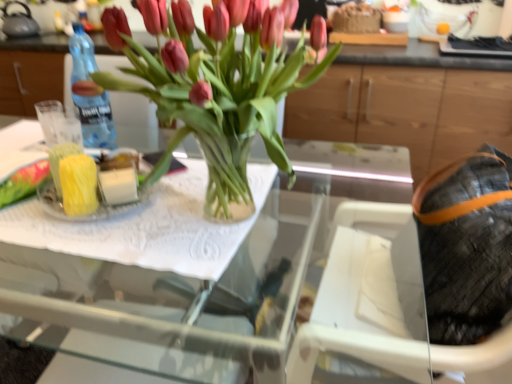
Question: Is leather textured bag at right taller or shorter than wooden cabinet at upper center?

Choices:
 (A) short
 (B) tall

Answer: (A)

Question: Do you think leather textured bag at right is within wooden cabinet at upper center, or outside of it?

Choices:
 (A) inside
 (B) outside

Answer: (B)

Question: Estimate the real-world distances between objects in this image. Which object is closer to the blue plastic bottle at left?

Choices:
 (A) clear glass tray at center
 (B) leather textured bag at right
 (C) transparent glass vase at center
 (D) wooden cabinet at upper center
 (E) matte gray kettle at upper left

Answer: (C)

Question: Which object is the farthest from the transparent glass vase at center?

Choices:
 (A) matte gray kettle at upper left
 (B) blue plastic bottle at left
 (C) leather textured bag at right
 (D) clear glass tray at center
 (E) wooden cabinet at upper center

Answer: (A)